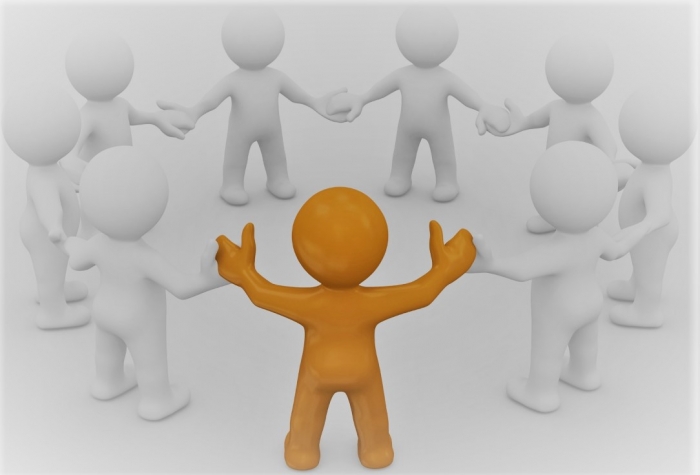
Find the location of `more gold figurines not in image`. more gold figurines not in image is located at coordinates (70, 229), (71, 151), (178, 100), (328, 90), (497, 95), (617, 156), (622, 242).